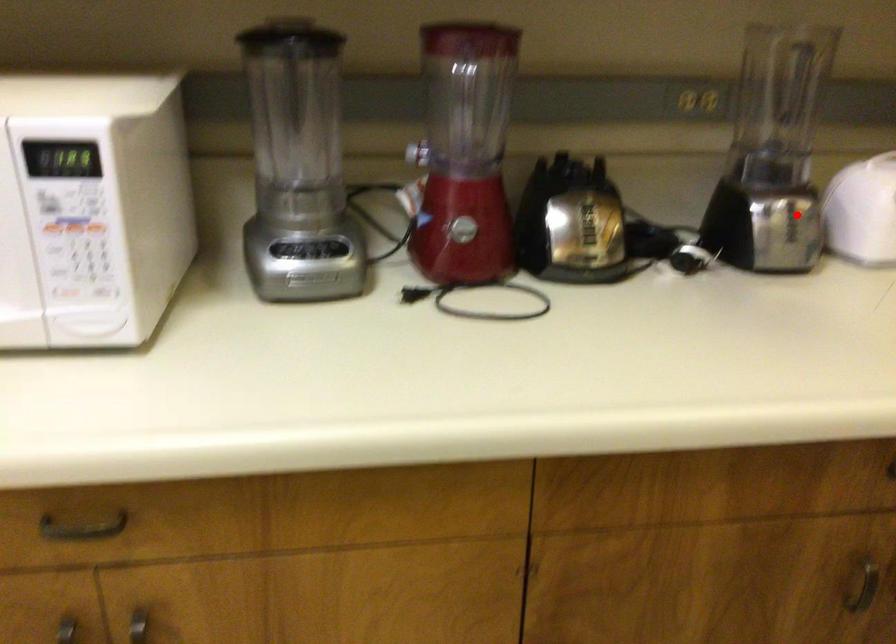
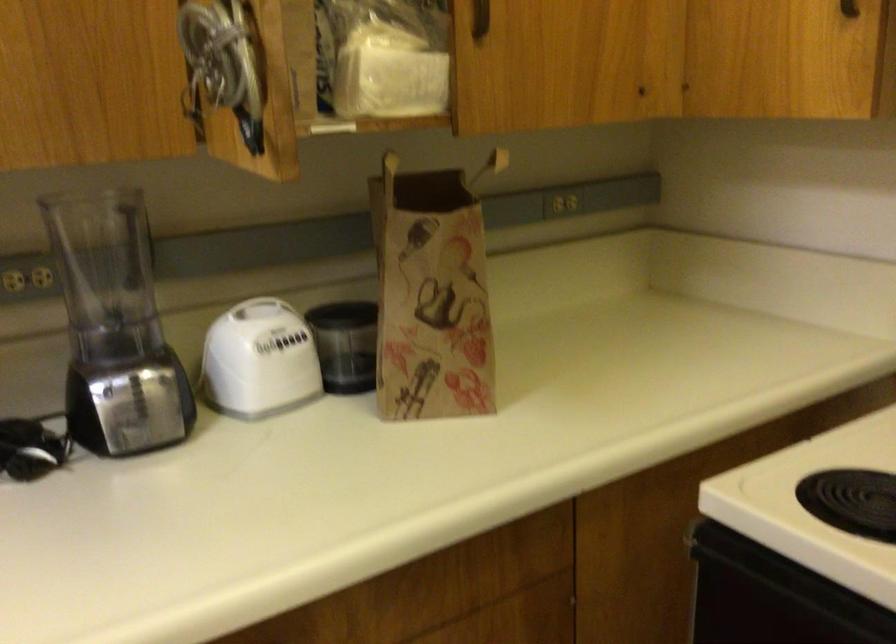
In the second image, find the point that corresponds to the highlighted location in the first image.

(149, 395)